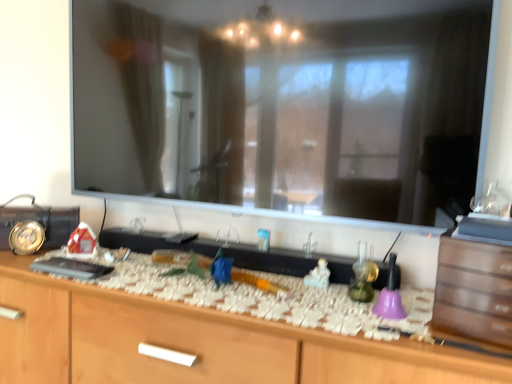
Question: Should I look upward or downward to see brown wooden drawer at right?

Choices:
 (A) up
 (B) down

Answer: (B)

Question: From the image's perspective, would you say wooden cabinet at center is shown under brown wooden drawer at right?

Choices:
 (A) no
 (B) yes

Answer: (B)

Question: Is brown wooden drawer at right at the back of wooden cabinet at center?

Choices:
 (A) no
 (B) yes

Answer: (A)

Question: Can brown wooden drawer at right be found inside wooden cabinet at center?

Choices:
 (A) no
 (B) yes

Answer: (A)

Question: Is wooden cabinet at center further to camera compared to brown wooden drawer at right?

Choices:
 (A) yes
 (B) no

Answer: (B)

Question: Does wooden cabinet at center lie in front of brown wooden drawer at right?

Choices:
 (A) yes
 (B) no

Answer: (A)

Question: Is wooden cabinet at center to the left of brown wooden drawer at right from the viewer's perspective?

Choices:
 (A) no
 (B) yes

Answer: (B)

Question: Can you see brown wooden drawer at right touching wooden cabinet at center?

Choices:
 (A) yes
 (B) no

Answer: (B)

Question: Can you confirm if brown wooden drawer at right is shorter than wooden cabinet at center?

Choices:
 (A) yes
 (B) no

Answer: (A)

Question: Is brown wooden drawer at right behind wooden cabinet at center?

Choices:
 (A) no
 (B) yes

Answer: (B)

Question: Can you confirm if brown wooden drawer at right is bigger than wooden cabinet at center?

Choices:
 (A) yes
 (B) no

Answer: (B)

Question: From the image's perspective, would you say brown wooden drawer at right is positioned over wooden cabinet at center?

Choices:
 (A) no
 (B) yes

Answer: (B)

Question: Would you say brown wooden drawer at right is outside wooden cabinet at center?

Choices:
 (A) no
 (B) yes

Answer: (B)

Question: Based on their sizes in the image, would you say wooden cabinet at center is bigger or smaller than brown wooden drawer at right?

Choices:
 (A) big
 (B) small

Answer: (A)